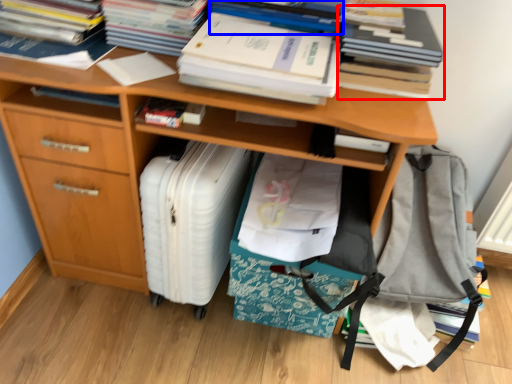
Question: Which of the following is the closest to the observer, book (highlighted by a red box) or book (highlighted by a blue box)?

Choices:
 (A) book
 (B) book

Answer: (A)